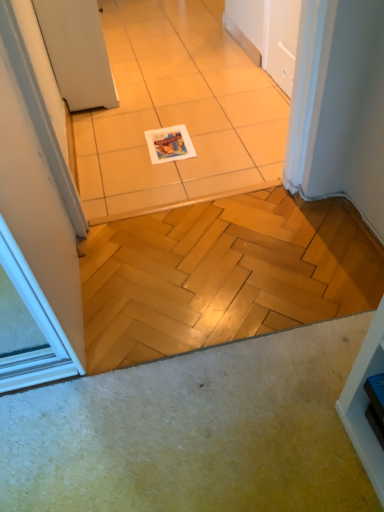
Question: From a real-world perspective, is white matte door at upper left below white glossy magazine at center?

Choices:
 (A) no
 (B) yes

Answer: (A)

Question: Is white glossy magazine at center inside white matte door at upper left?

Choices:
 (A) yes
 (B) no

Answer: (B)

Question: Would you say white matte door at upper left is a long distance from white glossy magazine at center?

Choices:
 (A) no
 (B) yes

Answer: (A)

Question: Is white matte door at upper left to the right of white glossy magazine at center from the viewer's perspective?

Choices:
 (A) no
 (B) yes

Answer: (A)

Question: Is white matte door at upper left positioned in front of white glossy magazine at center?

Choices:
 (A) no
 (B) yes

Answer: (B)

Question: Is the depth of white matte door at upper left greater than that of white glossy magazine at center?

Choices:
 (A) no
 (B) yes

Answer: (A)

Question: From the image's perspective, is white matte door at upper left beneath white glossy tile at center?

Choices:
 (A) yes
 (B) no

Answer: (B)

Question: Can you confirm if white matte door at upper left is positioned to the left of white glossy tile at center?

Choices:
 (A) no
 (B) yes

Answer: (B)

Question: Considering the relative sizes of white matte door at upper left and white glossy tile at center in the image provided, is white matte door at upper left bigger than white glossy tile at center?

Choices:
 (A) yes
 (B) no

Answer: (A)

Question: Does white matte door at upper left have a smaller size compared to white glossy tile at center?

Choices:
 (A) yes
 (B) no

Answer: (B)

Question: Does white matte door at upper left have a greater width compared to white glossy tile at center?

Choices:
 (A) yes
 (B) no

Answer: (B)

Question: Is white glossy tile at center surrounded by white matte door at upper left?

Choices:
 (A) no
 (B) yes

Answer: (A)

Question: Is white glossy tile at center with white glossy magazine at center?

Choices:
 (A) no
 (B) yes

Answer: (A)